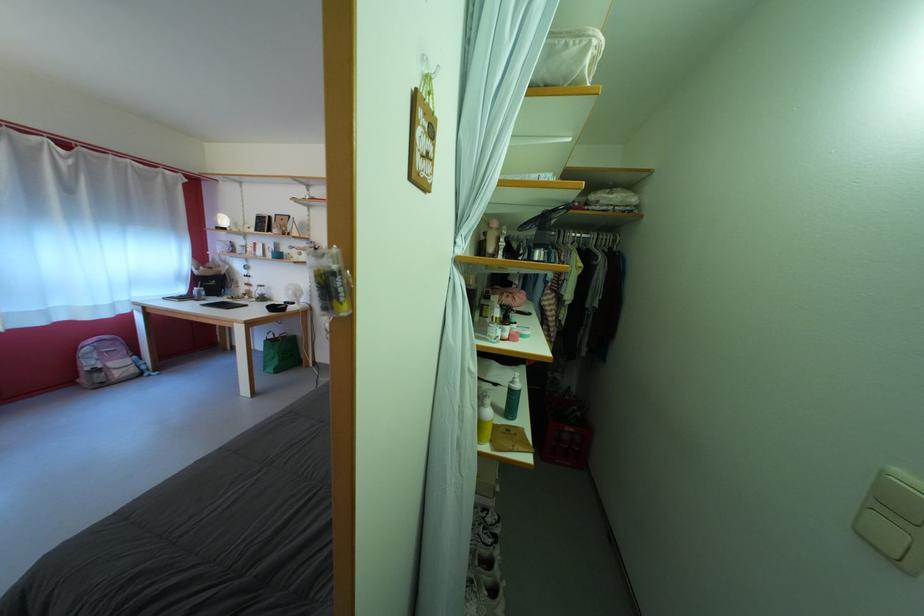
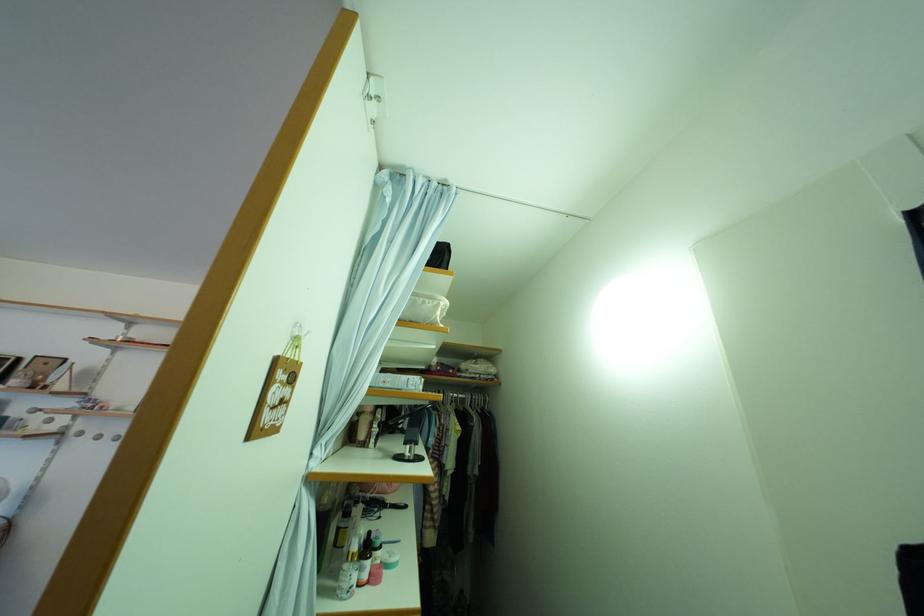
The point at (575, 52) is marked in the first image. Where is the corresponding point in the second image?

(432, 309)